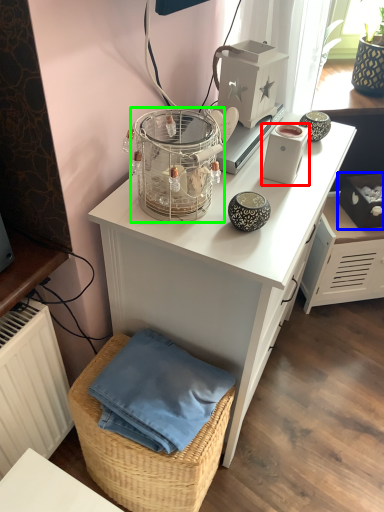
Question: Which object is positioned farthest from appliance (highlighted by a red box)? Select from box (highlighted by a blue box) and bird cage (highlighted by a green box).

Choices:
 (A) box
 (B) bird cage

Answer: (A)